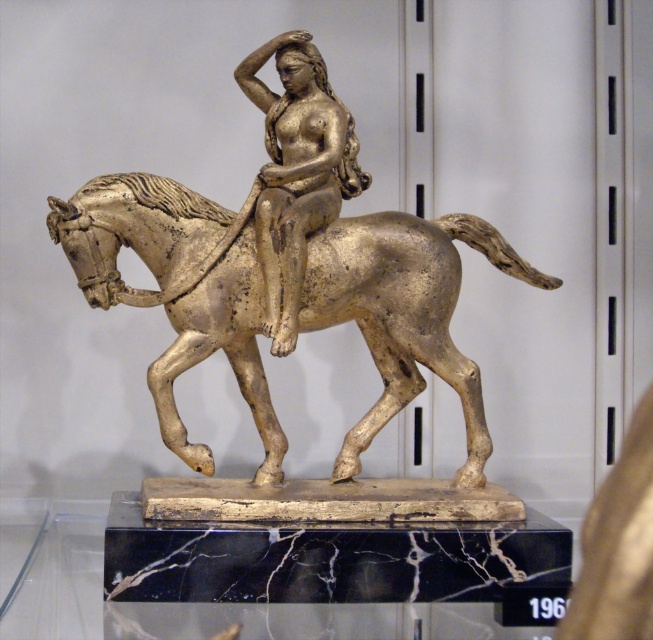
Question: Does gold polished horse at center have a lesser width compared to gold metallic figure at center?

Choices:
 (A) no
 (B) yes

Answer: (A)

Question: Is gold polished horse at center wider than gold metallic figure at center?

Choices:
 (A) no
 (B) yes

Answer: (B)

Question: Which of the following is the farthest from the observer?

Choices:
 (A) (449, 268)
 (B) (276, 316)

Answer: (A)

Question: Which object is farther from the camera taking this photo?

Choices:
 (A) gold polished horse at center
 (B) gold metallic figure at center

Answer: (A)

Question: Where is gold polished horse at center located in relation to gold metallic figure at center in the image?

Choices:
 (A) left
 (B) right

Answer: (A)

Question: Which of the following is the farthest from the observer?

Choices:
 (A) gold polished horse at center
 (B) gold metallic figure at center

Answer: (A)